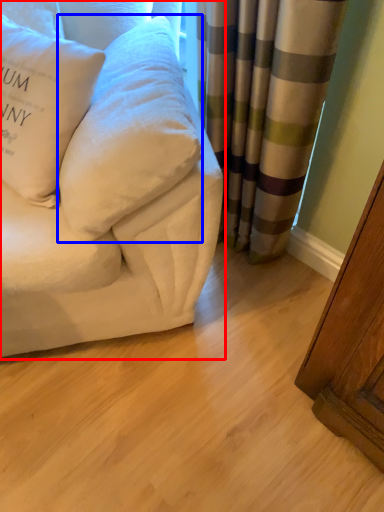
Question: Which object is further to the camera taking this photo, studio couch (highlighted by a red box) or pillow (highlighted by a blue box)?

Choices:
 (A) studio couch
 (B) pillow

Answer: (B)